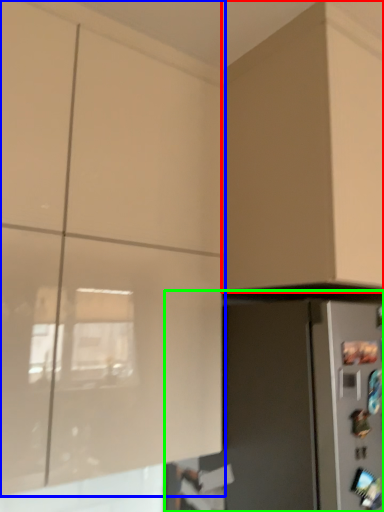
Question: Which object is the farthest from cabinetry (highlighted by a red box)? Choose among these: cabinetry (highlighted by a blue box) or appliance (highlighted by a green box).

Choices:
 (A) cabinetry
 (B) appliance

Answer: (A)